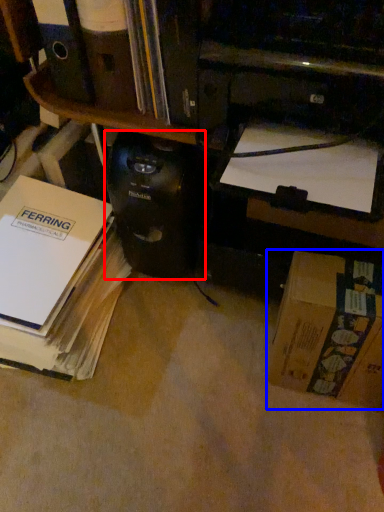
Question: Which point is closer to the camera, computer tower (highlighted by a red box) or box (highlighted by a blue box)?

Choices:
 (A) computer tower
 (B) box

Answer: (B)